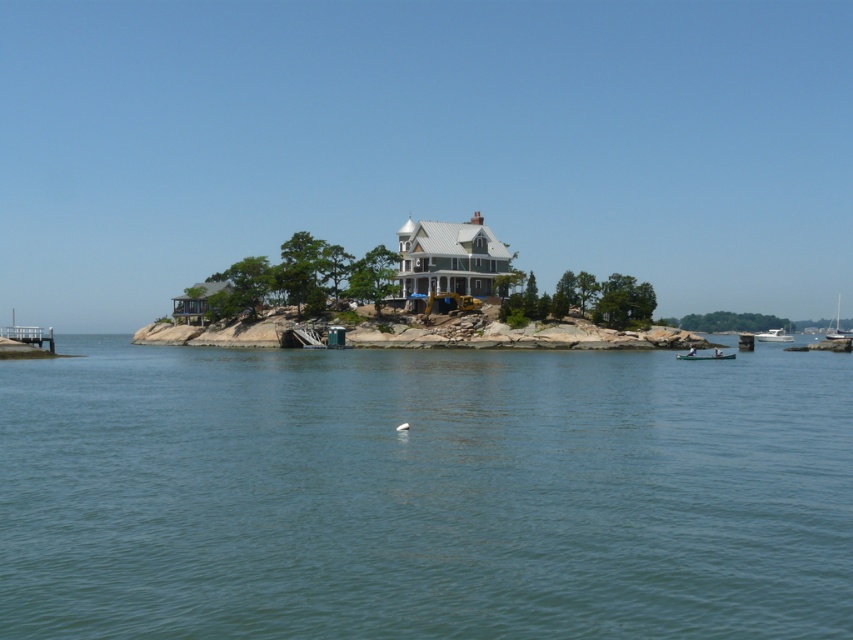
Question: Is wooden pier at lower left to the left of wooden canoe at lower right from the viewer's perspective?

Choices:
 (A) yes
 (B) no

Answer: (A)

Question: Among these points, which one is farthest from the camera?

Choices:
 (A) (16, 337)
 (B) (730, 355)
 (C) (782, 337)

Answer: (C)

Question: Does wooden canoe at lower right have a smaller size compared to white matte bird at center?

Choices:
 (A) yes
 (B) no

Answer: (B)

Question: Which object is the farthest from the white glossy boat at lower right?

Choices:
 (A) white matte bird at center
 (B) white sailboat at right
 (C) wooden pier at lower left
 (D) wooden canoe at lower right

Answer: (C)

Question: Which is farther from the clear blue water at center?

Choices:
 (A) wooden canoe at lower right
 (B) wooden pier at lower left
 (C) white sailboat at right

Answer: (C)

Question: Is clear blue water at center to the left of wooden canoe at lower right from the viewer's perspective?

Choices:
 (A) no
 (B) yes

Answer: (B)